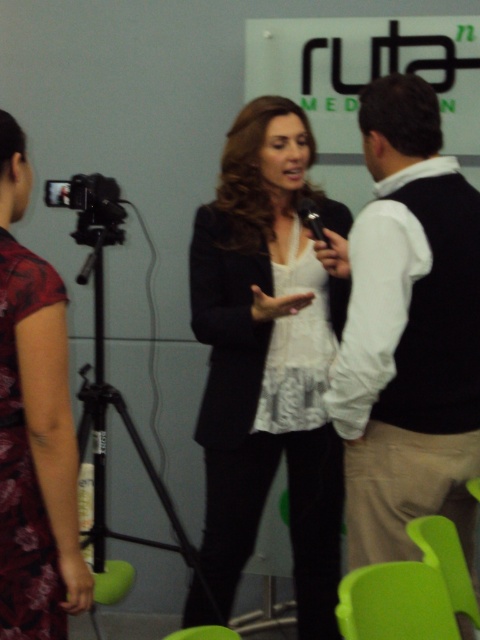
Who is positioned more to the left, white matte blazer at center or floral silk dress at left?

floral silk dress at left

Between white matte blazer at center and floral silk dress at left, which one is positioned higher?

white matte blazer at center

Is point (319, 605) farther from viewer compared to point (8, 593)?

Yes, point (319, 605) is behind point (8, 593).

You are a GUI agent. You are given a task and a screenshot of the screen. Output one action in this format:
    pyautogui.click(x=<x>, y=<y>)
    Task: Click on the white matte blazer at center
    The width and height of the screenshot is (480, 640).
    Given the screenshot: What is the action you would take?
    pyautogui.click(x=265, y=362)

Who is shorter, black sweater at center or floral silk dress at left?

floral silk dress at left

Who is lower down, black sweater at center or floral silk dress at left?

floral silk dress at left

At what (x,y) coordinates should I click in order to perform the action: click on black sweater at center. Please return your answer as a coordinate pair (x, y). This screenshot has height=640, width=480. Looking at the image, I should click on (408, 332).

The height and width of the screenshot is (640, 480). Identify the location of black sweater at center. (408, 332).

Is point (412, 145) positioned behind point (259, 512)?

No.

From the picture: Is black sweater at center positioned before white matte blazer at center?

That is True.

Does point (457, 404) come farther from viewer compared to point (303, 440)?

No, (457, 404) is closer to viewer.

Identify the location of black sweater at center. This screenshot has width=480, height=640. (408, 332).